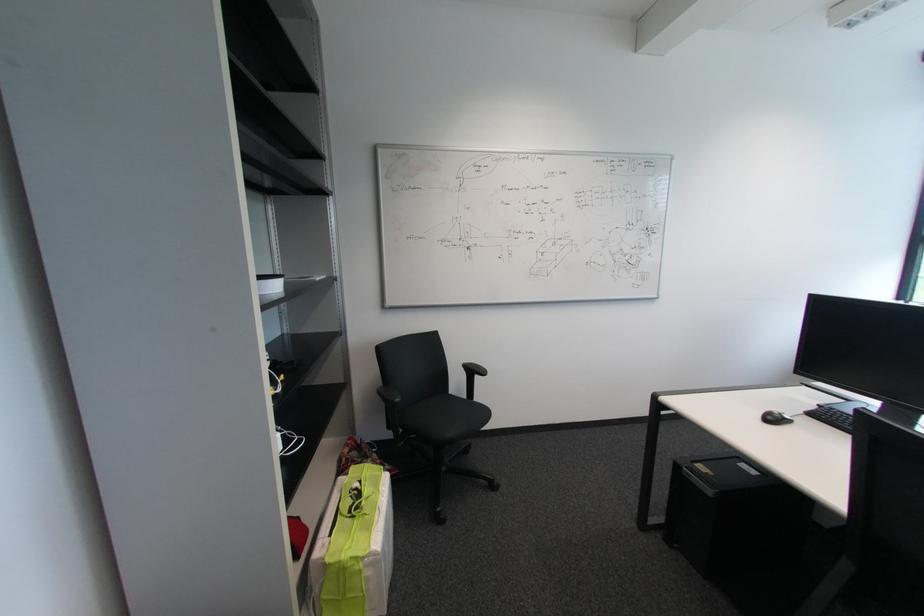
The location [775,418] corresponds to which object?

This point indicates the black computer mouse.